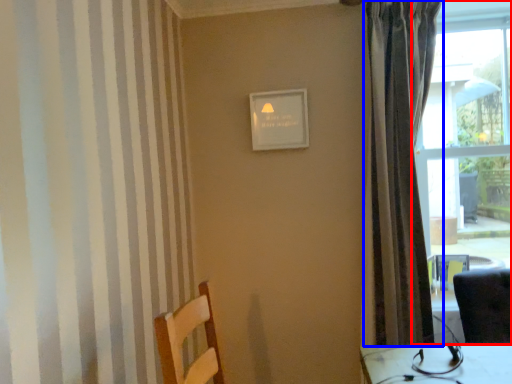
Question: Which of the following is the farthest to the observer, window (highlighted by a red box) or curtain (highlighted by a blue box)?

Choices:
 (A) window
 (B) curtain

Answer: (A)